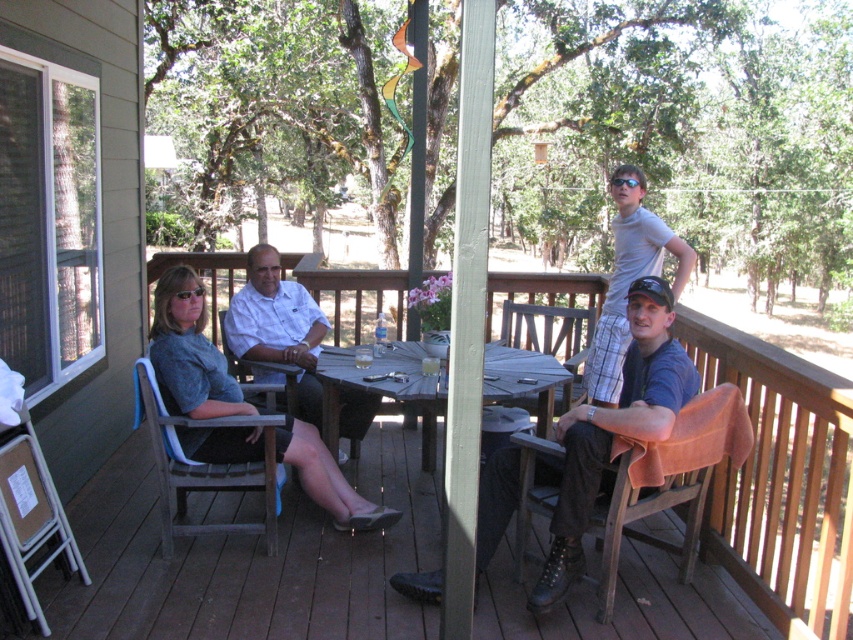
You are standing on the wooden deck and want to place a small potted plant exactly at the point labeled as point [683,428]. Considering the deck is 10 feet long from front to back, will the plant be placed near the front or the back of the deck?

The point [683,428] is 9.99 feet away from the viewer, which is almost the full length of the 10 feet deck. Therefore, placing the plant at this point would position it near the back of the deck.

You are standing on the wooden deck and want to sit down. You see the brown wooden chair at lower right and the light gray plaid shorts at upper right. Which object is closer to the ground?

The brown wooden chair at lower right is located below light gray plaid shorts at upper right, so it is closer to the ground.